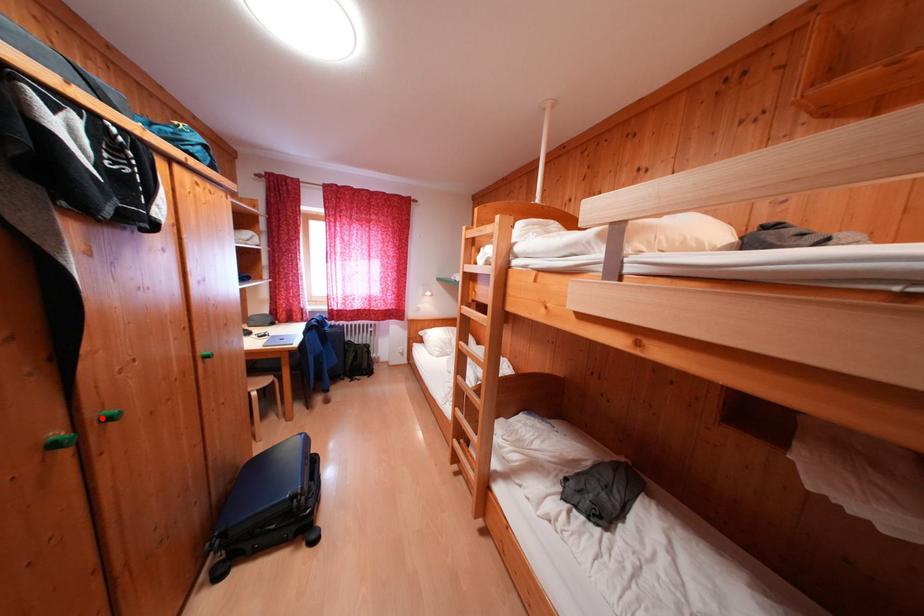
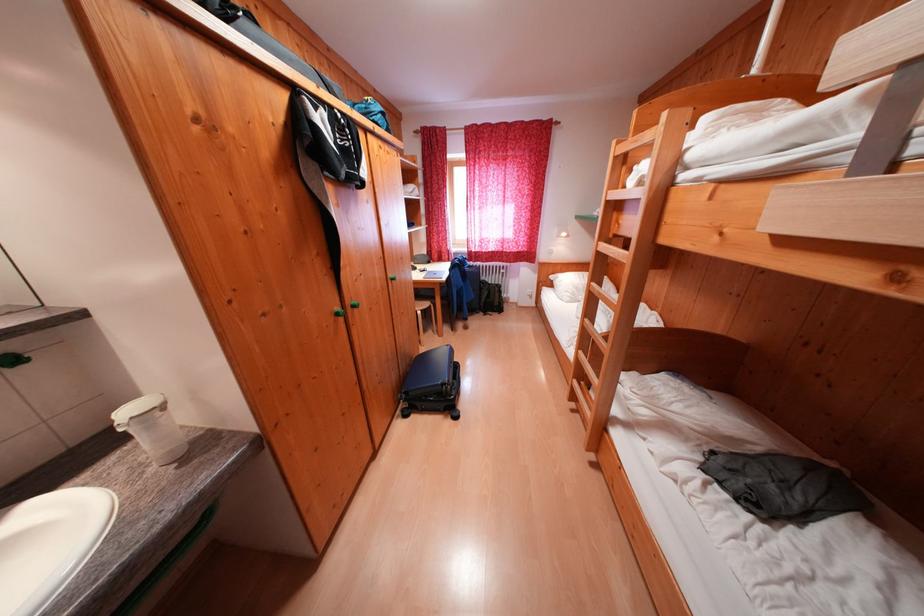
Find the pixel in the second image that matches the highlighted location in the first image.

(357, 306)